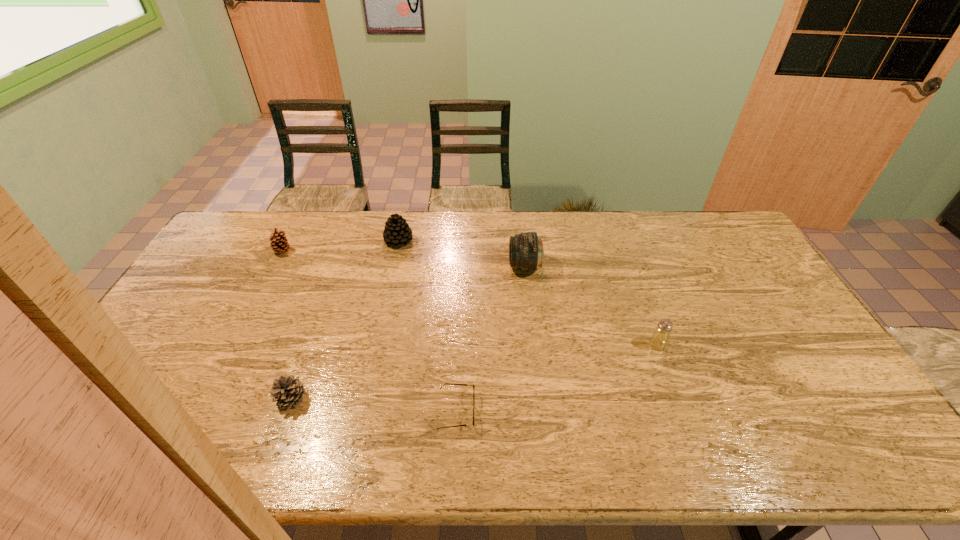
Identify the location of telephoto lens. (526, 253).

What are the coordinates of `the third object from left to right` in the screenshot? It's located at (397, 232).

This screenshot has width=960, height=540. Find the location of `the leftmost object`. the leftmost object is located at coordinates (279, 244).

In order to click on the second shortest pinecone in this screenshot , I will do `click(279, 244)`.

The width and height of the screenshot is (960, 540). I want to click on the rightmost object, so click(659, 339).

Where is `the third nearest object`? This screenshot has width=960, height=540. the third nearest object is located at coordinates (659, 339).

The image size is (960, 540). In order to click on the second pinecone from left to right in this screenshot , I will do `click(287, 391)`.

I want to click on the second object from left to right, so click(287, 391).

Locate an element on the screen. spectacles is located at coordinates (444, 384).

I want to click on the fourth object from left to right, so click(444, 384).